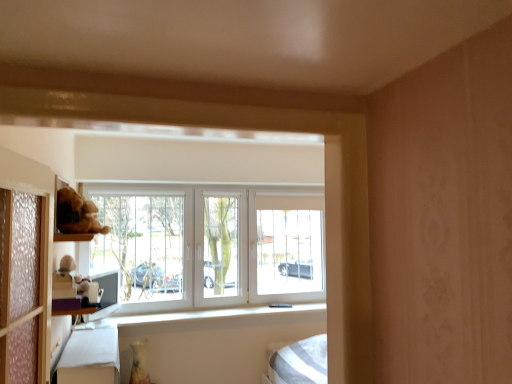
Question: Is white plush toy at left smaller than white fabric bed frame at lower left?

Choices:
 (A) yes
 (B) no

Answer: (A)

Question: From a real-world perspective, is white plush toy at left over white fabric bed frame at lower left?

Choices:
 (A) yes
 (B) no

Answer: (A)

Question: Is white plush toy at left at the right side of white fabric bed frame at lower left?

Choices:
 (A) no
 (B) yes

Answer: (A)

Question: From a real-world perspective, is white plush toy at left located beneath white fabric bed frame at lower left?

Choices:
 (A) no
 (B) yes

Answer: (A)

Question: Considering the relative positions of white plush toy at left and white fabric bed frame at lower left in the image provided, is white plush toy at left in front of white fabric bed frame at lower left?

Choices:
 (A) no
 (B) yes

Answer: (A)

Question: Is white plush toy at left positioned far away from white fabric bed frame at lower left?

Choices:
 (A) no
 (B) yes

Answer: (A)

Question: Does white plastic window at center have a lesser height compared to white plush toy at left?

Choices:
 (A) no
 (B) yes

Answer: (A)

Question: Is the depth of white plastic window at center less than that of white plush toy at left?

Choices:
 (A) yes
 (B) no

Answer: (B)

Question: Are white plastic window at center and white plush toy at left beside each other?

Choices:
 (A) no
 (B) yes

Answer: (A)

Question: Considering the relative positions of white plastic window at center and white plush toy at left in the image provided, is white plastic window at center to the left of white plush toy at left from the viewer's perspective?

Choices:
 (A) yes
 (B) no

Answer: (B)

Question: Does white plastic window at center have a larger size compared to white plush toy at left?

Choices:
 (A) yes
 (B) no

Answer: (A)

Question: Is white plastic window at center far from white plush toy at left?

Choices:
 (A) yes
 (B) no

Answer: (A)

Question: Can you confirm if white plastic window at center is shorter than white fabric bed frame at lower left?

Choices:
 (A) no
 (B) yes

Answer: (A)